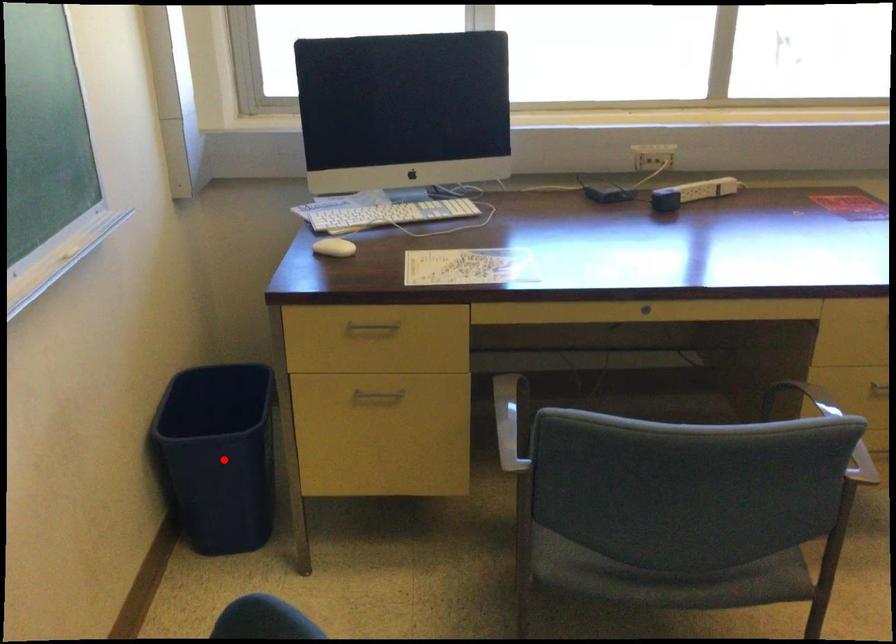
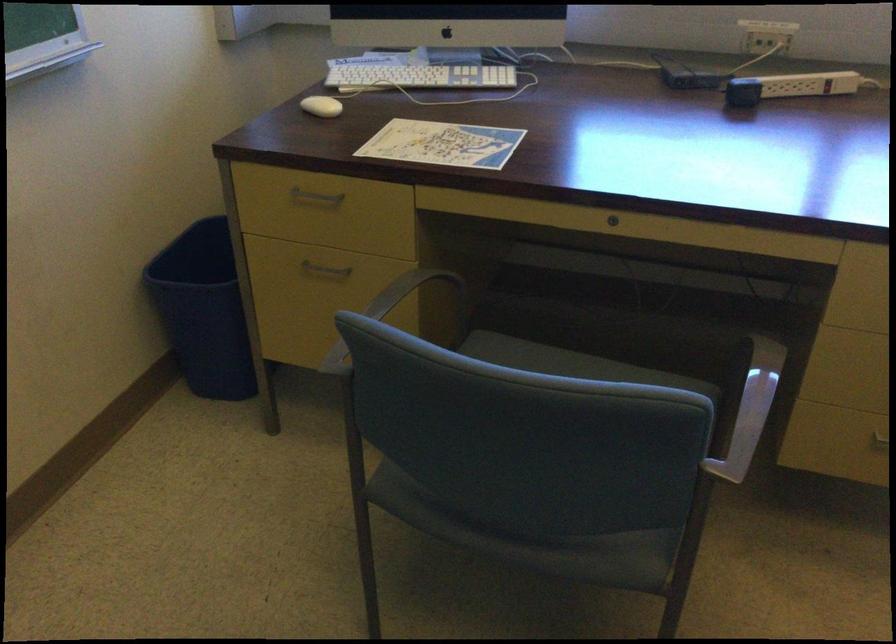
Where in the second image is the point corresponding to the highlighted location from the first image?

(202, 310)